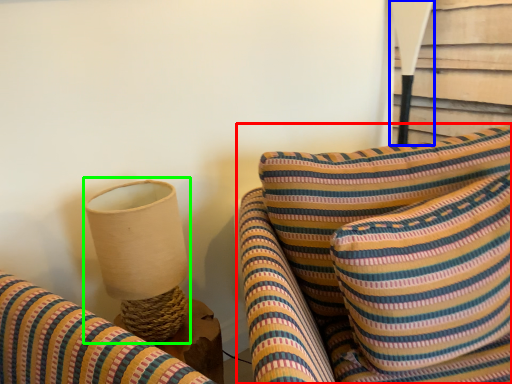
Question: Which object is the closest to the furniture (highlighted by a red box)? Choose among these: table lamp (highlighted by a blue box) or table lamp (highlighted by a green box).

Choices:
 (A) table lamp
 (B) table lamp

Answer: (B)